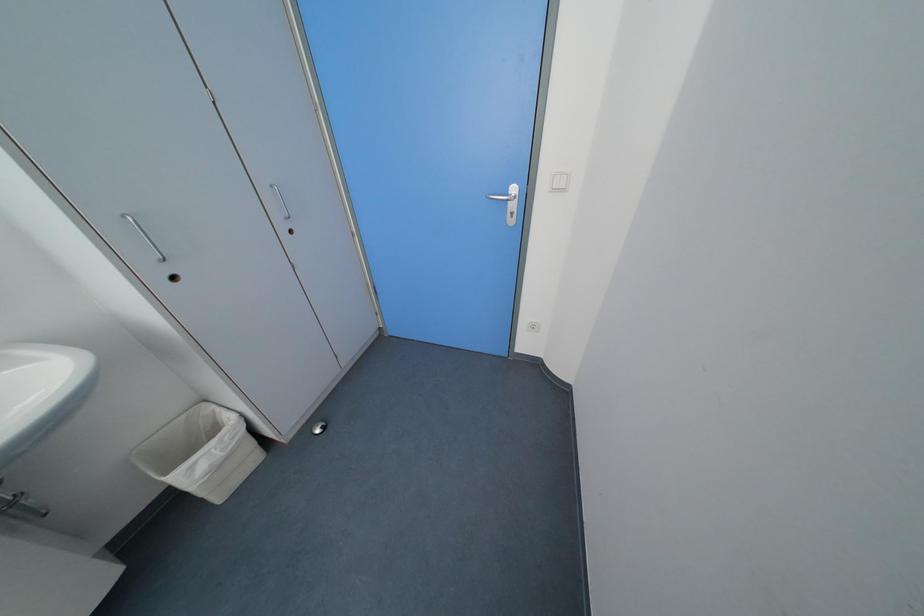
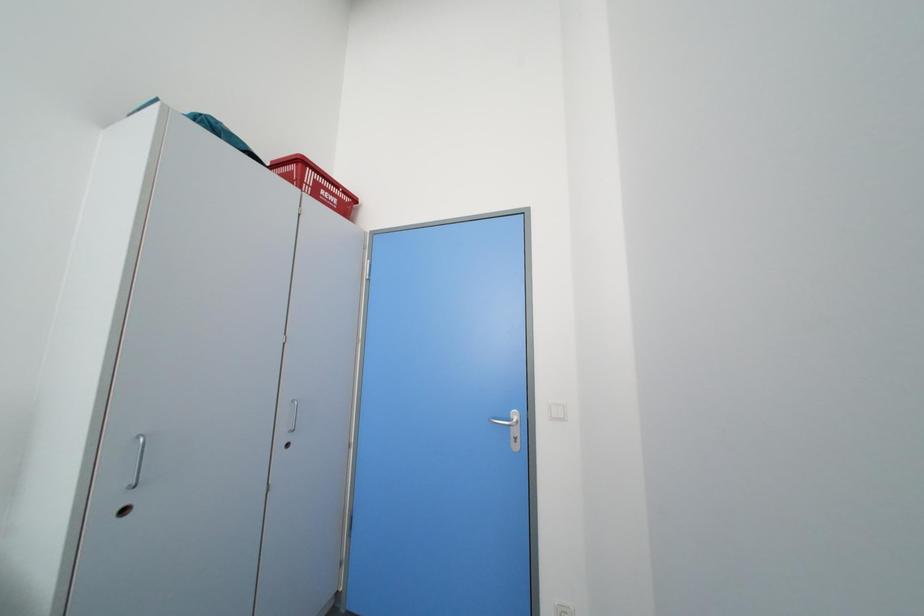
Question: The images are taken continuously from a first-person perspective. In which direction is your viewpoint rotating?

Choices:
 (A) Left
 (B) Right
 (C) Up
 (D) Down

Answer: (C)